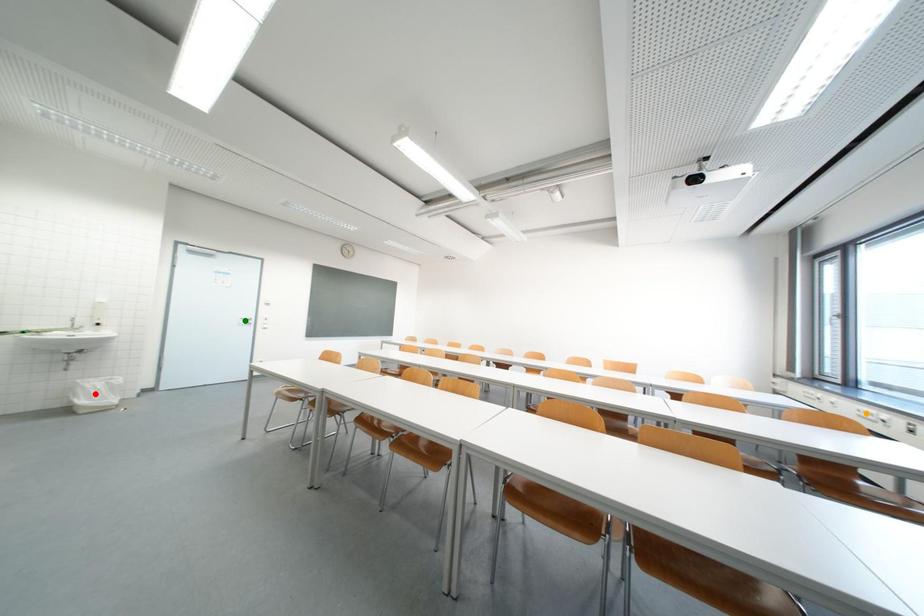
Consider the image. Order these from nearest to farthest:
A) green point
B) orange point
C) red point

orange point, red point, green point